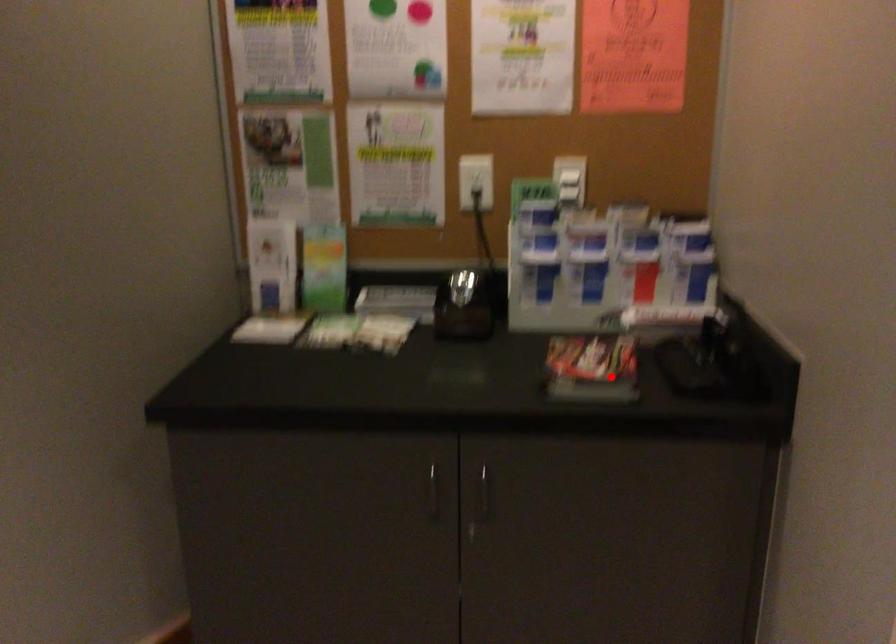
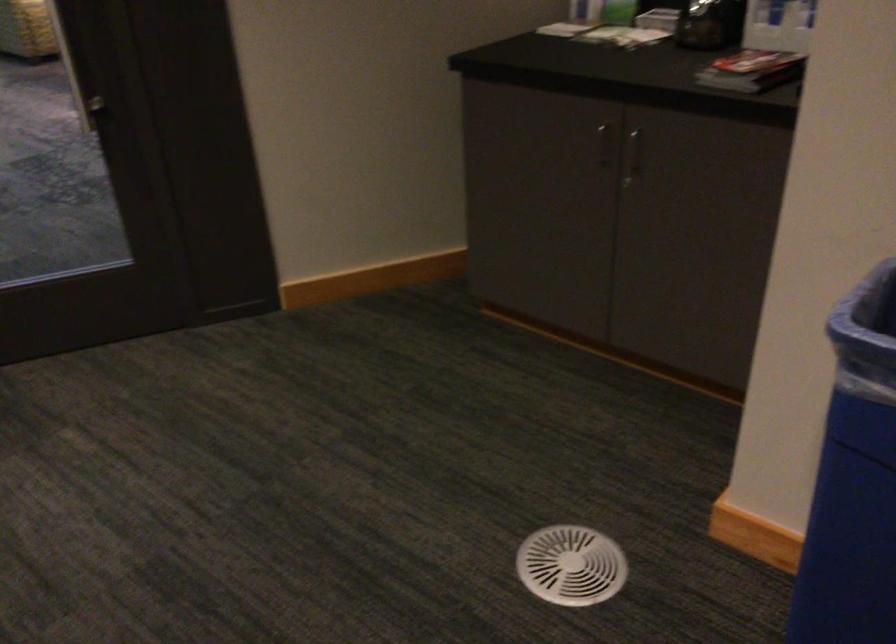
Question: A red point is marked in image1. In image2, is the corresponding 3D point closer to the camera or farther? Reply with the corresponding letter.

Choices:
 (A) The corresponding 3D point is closer.
 (B) The corresponding 3D point is farther.

Answer: (B)